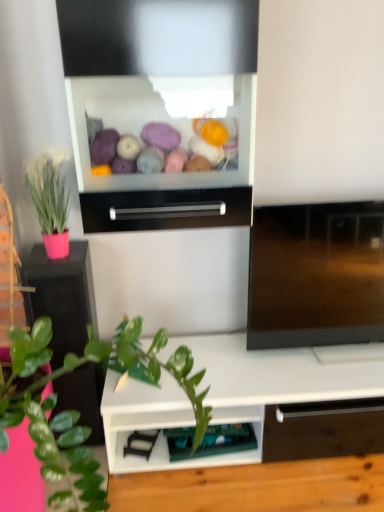
Measure the distance between point (43, 230) and camera.

The depth of point (43, 230) is 1.58 meters.

Describe the element at coordinates (61, 297) in the screenshot. The image size is (384, 512). I see `pink matte plant pot at left` at that location.

At what (x,y) coordinates should I click in order to perform the action: click on matte pink pot at left. Please return your answer as a coordinate pair (x, y). This screenshot has height=512, width=384. Looking at the image, I should click on (49, 203).

From a real-world perspective, is green plastic shelf at lower center over black glossy drawer at center?

No, from a real-world perspective, green plastic shelf at lower center is not on top of black glossy drawer at center.

The image size is (384, 512). Find the location of `shelf behind the black glossy drawer at center`. shelf behind the black glossy drawer at center is located at coordinates (210, 441).

Choose the correct answer: Is green plastic shelf at lower center inside black glossy drawer at center or outside it?

green plastic shelf at lower center is spatially situated outside black glossy drawer at center.

Is black glossy drawer at center at the back of green plastic shelf at lower center?

That's not correct — green plastic shelf at lower center is not looking away from black glossy drawer at center.

Does matte pink pot at left contain black glossy drawer at center?

No, matte pink pot at left does not contain black glossy drawer at center.

Does point (64, 207) appear closer or farther from the camera than point (239, 223)?

Point (64, 207) is farther from the camera than point (239, 223).

Is matte pink pot at left oriented towards black glossy drawer at center?

No, matte pink pot at left is not facing towards black glossy drawer at center.

Based on the photo, is matte pink pot at left beside black glossy drawer at center?

matte pink pot at left is not next to black glossy drawer at center, and they're not touching.

Does black glossy drawer at center contain matte pink pot at left?

That's incorrect, matte pink pot at left is not inside black glossy drawer at center.

From the image's perspective, does black glossy drawer at center appear higher than matte pink pot at left?

No, from the image's perspective, black glossy drawer at center is not on top of matte pink pot at left.

Between black glossy drawer at center and matte pink pot at left, which one appears on the left side from the viewer's perspective?

From the viewer's perspective, matte pink pot at left appears more on the left side.

Which of these two, pink matte plant pot at left or green plastic shelf at lower center, is thinner?

green plastic shelf at lower center is thinner.

Does pink matte plant pot at left turn towards green plastic shelf at lower center?

No, pink matte plant pot at left is not turned towards green plastic shelf at lower center.

Is pink matte plant pot at left next to green plastic shelf at lower center and touching it?

No.

In the scene shown: Which point is more distant from viewer, (43,279) or (231,438)?

The point (231,438) is farther from the camera.

Which point is more forward, [206,435] or [57,388]?

The point [57,388] is closer.

Considering the sizes of objects green plastic shelf at lower center and pink matte plant pot at left in the image provided, who is thinner, green plastic shelf at lower center or pink matte plant pot at left?

Thinner between the two is green plastic shelf at lower center.

Which object is positioned more to the right, green plastic shelf at lower center or pink matte plant pot at left?

green plastic shelf at lower center is more to the right.

Is green plastic shelf at lower center oriented away from pink matte plant pot at left?

No, green plastic shelf at lower center is not facing the opposite direction of pink matte plant pot at left.

Considering the relative positions of pink matte plant pot at left and matte pink pot at left in the image provided, is pink matte plant pot at left to the right of matte pink pot at left from the viewer's perspective?

Yes.

Which of these two, pink matte plant pot at left or matte pink pot at left, stands shorter?

matte pink pot at left.

Considering the sizes of pink matte plant pot at left and matte pink pot at left in the image, is pink matte plant pot at left wider or thinner than matte pink pot at left?

In the image, pink matte plant pot at left appears to be wider than matte pink pot at left.

Considering the sizes of black glossy drawer at center and green plastic shelf at lower center in the image, is black glossy drawer at center taller or shorter than green plastic shelf at lower center?

In the image, black glossy drawer at center appears to be taller than green plastic shelf at lower center.

From the picture: Measure the distance between black glossy drawer at center and green plastic shelf at lower center.

black glossy drawer at center and green plastic shelf at lower center are 35.62 inches apart.

Considering the positions of point (222, 198) and point (253, 431), is point (222, 198) closer or farther from the camera than point (253, 431)?

Clearly, point (222, 198) is closer to the camera than point (253, 431).

Looking at their sizes, would you say black glossy drawer at center is wider or thinner than green plastic shelf at lower center?

In the image, black glossy drawer at center appears to be wider than green plastic shelf at lower center.

This screenshot has width=384, height=512. In order to click on drawer in front of the green plastic shelf at lower center in this screenshot , I will do `click(166, 209)`.

Where is `houseplant located above the black glossy drawer at center (from a real-world perspective)`? The image size is (384, 512). houseplant located above the black glossy drawer at center (from a real-world perspective) is located at coordinates (49, 203).

Looking at the image, which one is located further to green plastic shelf at lower center, black glossy drawer at center or pink matte plant pot at left?

The object further to green plastic shelf at lower center is black glossy drawer at center.

In the scene shown: Which object lies further to the anchor point black glossy drawer at center, green plastic shelf at lower center or matte pink pot at left?

Among the two, green plastic shelf at lower center is located further to black glossy drawer at center.

Considering their positions, is green plastic shelf at lower center positioned further to pink matte plant pot at left than black glossy drawer at center?

green plastic shelf at lower center is positioned further to the anchor pink matte plant pot at left.

Looking at the image, which one is located closer to matte pink pot at left, black glossy drawer at center or pink matte plant pot at left?

pink matte plant pot at left is positioned closer to the anchor matte pink pot at left.

Estimate the real-world distances between objects in this image. Which object is further from matte pink pot at left, green plastic shelf at lower center or pink matte plant pot at left?

green plastic shelf at lower center.

Based on their spatial positions, is green plastic shelf at lower center or pink matte plant pot at left closer to black glossy drawer at center?

pink matte plant pot at left is closer to black glossy drawer at center.

Looking at the image, which one is located further to black glossy drawer at center, matte pink pot at left or green plastic shelf at lower center?

Based on the image, green plastic shelf at lower center appears to be further to black glossy drawer at center.

When comparing their distances from pink matte plant pot at left, does green plastic shelf at lower center or matte pink pot at left seem closer?

Based on the image, matte pink pot at left appears to be nearer to pink matte plant pot at left.

Locate an element on the screen. This screenshot has width=384, height=512. table between matte pink pot at left and green plastic shelf at lower center vertically is located at coordinates (61, 297).

Where is `drawer between matte pink pot at left and green plastic shelf at lower center in the vertical direction`? This screenshot has height=512, width=384. drawer between matte pink pot at left and green plastic shelf at lower center in the vertical direction is located at coordinates (166, 209).

What are the coordinates of `table between black glossy drawer at center and green plastic shelf at lower center vertically` in the screenshot? It's located at (61, 297).

You are a GUI agent. You are given a task and a screenshot of the screen. Output one action in this format:
    pyautogui.click(x=<x>, y=<y>)
    Task: Click on the drawer that lies between matte pink pot at left and pink matte plant pot at left from top to bottom
    This screenshot has width=384, height=512.
    Given the screenshot: What is the action you would take?
    pyautogui.click(x=166, y=209)